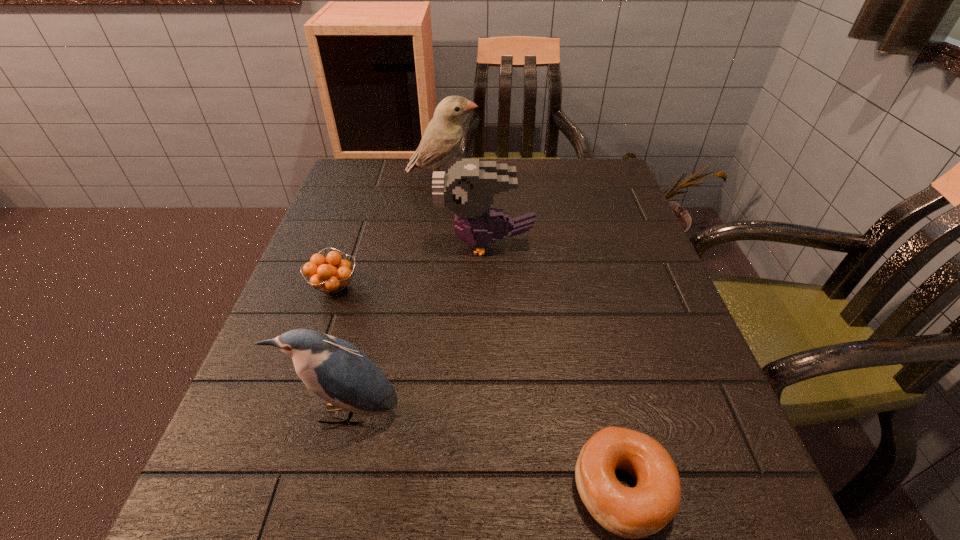
Where is `unoccupied area between the nearest bird and the fourth nearest object`? Image resolution: width=960 pixels, height=540 pixels. unoccupied area between the nearest bird and the fourth nearest object is located at coordinates (416, 329).

The height and width of the screenshot is (540, 960). Find the location of `free point between the second nearest bird and the orange fruit`. free point between the second nearest bird and the orange fruit is located at coordinates [x=410, y=266].

Where is `free space that is in between the fourth nearest object and the orange fruit`? Image resolution: width=960 pixels, height=540 pixels. free space that is in between the fourth nearest object and the orange fruit is located at coordinates (410, 266).

Locate an element on the screen. The image size is (960, 540). free space between the farthest bird and the orange fruit is located at coordinates (389, 233).

At what (x,y) coordinates should I click in order to perform the action: click on the fourth closest object relative to the second shortest object. Please return your answer as a coordinate pair (x, y). This screenshot has height=540, width=960. Looking at the image, I should click on 633,513.

The image size is (960, 540). I want to click on object that is the second nearest to the shortest object, so click(468, 189).

Identify which bird is the third closest to the third farthest object. Please provide its 2D coordinates. Your answer should be formatted as a tuple, i.e. [(x, y)], where the tuple contains the x and y coordinates of a point satisfying the conditions above.

[(443, 135)]

Select which bird is the third closest to the bagel. Please provide its 2D coordinates. Your answer should be formatted as a tuple, i.e. [(x, y)], where the tuple contains the x and y coordinates of a point satisfying the conditions above.

[(443, 135)]

Locate an element on the screen. vacant region that satisfies the following two spatial constraints: 1. at the face of the farthest bird; 2. at the tip of the second nearest object's beak is located at coordinates (415, 413).

In order to click on free location that satisfies the following two spatial constraints: 1. at the face of the farthest object; 2. at the tip of the nearest bird's beak in this screenshot , I will do `click(415, 413)`.